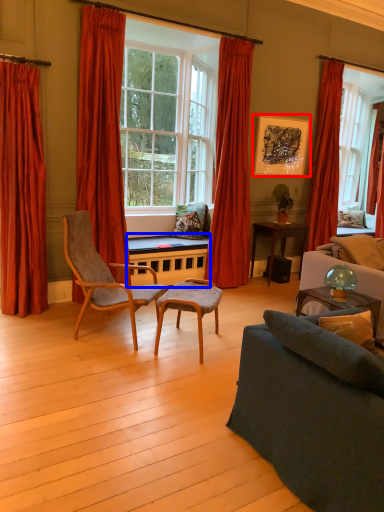
Question: Among these objects, which one is nearest to the camera, picture frame (highlighted by a red box) or table (highlighted by a blue box)?

Choices:
 (A) picture frame
 (B) table

Answer: (B)